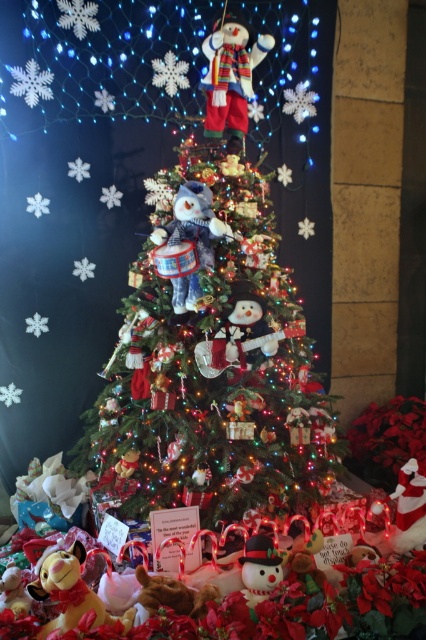
Identify the location of green matte christmas tree at center. (210, 358).

Is point (270, 253) in front of point (411, 512)?

No, (270, 253) is further to viewer.

Where is `green matte christmas tree at center`? Image resolution: width=426 pixels, height=640 pixels. green matte christmas tree at center is located at coordinates (210, 358).

Can you confirm if velvet plush cat at lower left is shorter than white plush santa at lower right?

In fact, velvet plush cat at lower left may be taller than white plush santa at lower right.

Is velvet plush cat at lower left positioned at the back of white plush santa at lower right?

No, it is in front of white plush santa at lower right.

Is point (126, 620) closer to viewer compared to point (409, 468)?

Yes, point (126, 620) is closer to viewer.

Locate an element on the screen. The image size is (426, 640). velvet plush cat at lower left is located at coordinates (69, 589).

Is fluffy blue plush at center positioned before velvet plush cat at lower left?

No, it is not.

Who is positioned more to the right, fluffy blue plush at center or velvet plush cat at lower left?

Positioned to the right is fluffy blue plush at center.

This screenshot has height=640, width=426. Describe the element at coordinates (190, 240) in the screenshot. I see `fluffy blue plush at center` at that location.

I want to click on fluffy blue plush at center, so pyautogui.click(x=190, y=240).